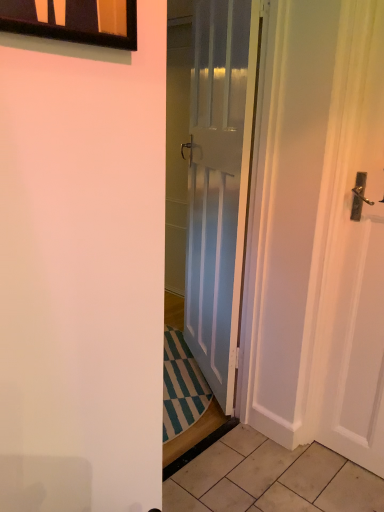
Question: Does black glass window at upper left appear on the left side of beige tile at lower right?

Choices:
 (A) yes
 (B) no

Answer: (A)

Question: Is beige tile at lower right surrounded by black glass window at upper left?

Choices:
 (A) yes
 (B) no

Answer: (B)

Question: From the image's perspective, is black glass window at upper left on beige tile at lower right?

Choices:
 (A) yes
 (B) no

Answer: (A)

Question: Can you confirm if black glass window at upper left is shorter than beige tile at lower right?

Choices:
 (A) no
 (B) yes

Answer: (A)

Question: Considering the relative positions of black glass window at upper left and beige tile at lower right in the image provided, is black glass window at upper left in front of beige tile at lower right?

Choices:
 (A) no
 (B) yes

Answer: (B)

Question: From a real-world perspective, is white glossy door at center physically located above or below black glass window at upper left?

Choices:
 (A) above
 (B) below

Answer: (B)

Question: From the image's perspective, is white glossy door at center positioned above or below black glass window at upper left?

Choices:
 (A) below
 (B) above

Answer: (A)

Question: Considering the relative positions of white glossy door at center and black glass window at upper left in the image provided, is white glossy door at center to the left or to the right of black glass window at upper left?

Choices:
 (A) left
 (B) right

Answer: (B)

Question: Is white glossy door at center in front of or behind black glass window at upper left in the image?

Choices:
 (A) front
 (B) behind

Answer: (B)

Question: Considering the positions of white glossy door at center and beige tile at lower right in the image, is white glossy door at center bigger or smaller than beige tile at lower right?

Choices:
 (A) big
 (B) small

Answer: (A)

Question: Considering the relative positions of white glossy door at center and beige tile at lower right in the image provided, is white glossy door at center to the left or to the right of beige tile at lower right?

Choices:
 (A) left
 (B) right

Answer: (A)

Question: From the image's perspective, relative to beige tile at lower right, is white glossy door at center above or below?

Choices:
 (A) below
 (B) above

Answer: (B)

Question: In terms of width, does white glossy door at center look wider or thinner when compared to beige tile at lower right?

Choices:
 (A) wide
 (B) thin

Answer: (B)

Question: Looking at the image, does black glass window at upper left seem bigger or smaller compared to beige tile at lower right?

Choices:
 (A) small
 (B) big

Answer: (B)

Question: Is point (79, 9) positioned closer to the camera than point (324, 448)?

Choices:
 (A) closer
 (B) farther

Answer: (A)